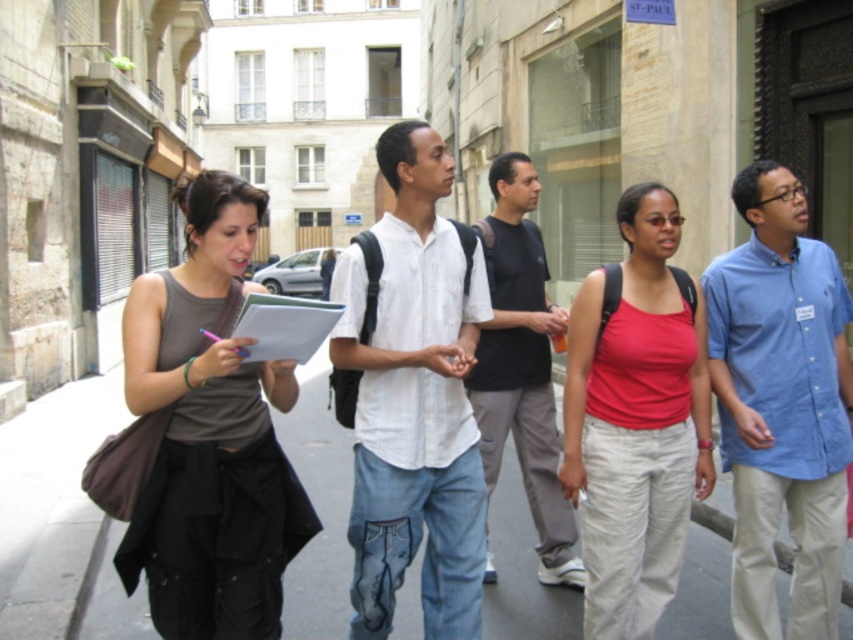
Question: Is matte gray tank top at center thinner than blue button-down shirt at right?

Choices:
 (A) yes
 (B) no

Answer: (B)

Question: Which point is farther to the camera?

Choices:
 (A) (531, 413)
 (B) (834, 435)
 (C) (308, 406)

Answer: (C)

Question: Which of these objects is positioned closest to the gray asphalt pavement at center?

Choices:
 (A) matte gray tank top at center
 (B) matte red tank top at center

Answer: (A)

Question: Which point is farther to the camera?

Choices:
 (A) white cotton shirt at center
 (B) blue button-down shirt at right

Answer: (B)

Question: Is matte gray tank top at center thinner than blue button-down shirt at right?

Choices:
 (A) yes
 (B) no

Answer: (B)

Question: Is matte red tank top at center below black cotton shirt at center?

Choices:
 (A) no
 (B) yes

Answer: (B)